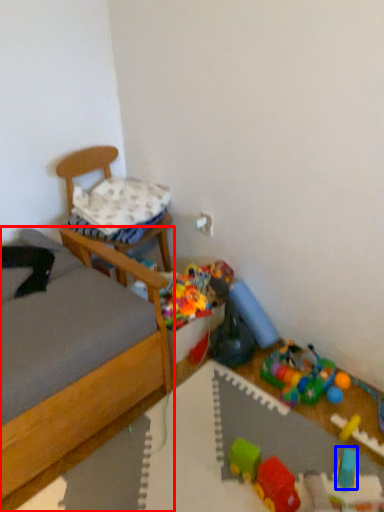
Question: Which object is further to the camera taking this photo, bed (highlighted by a red box) or toy (highlighted by a blue box)?

Choices:
 (A) bed
 (B) toy

Answer: (B)